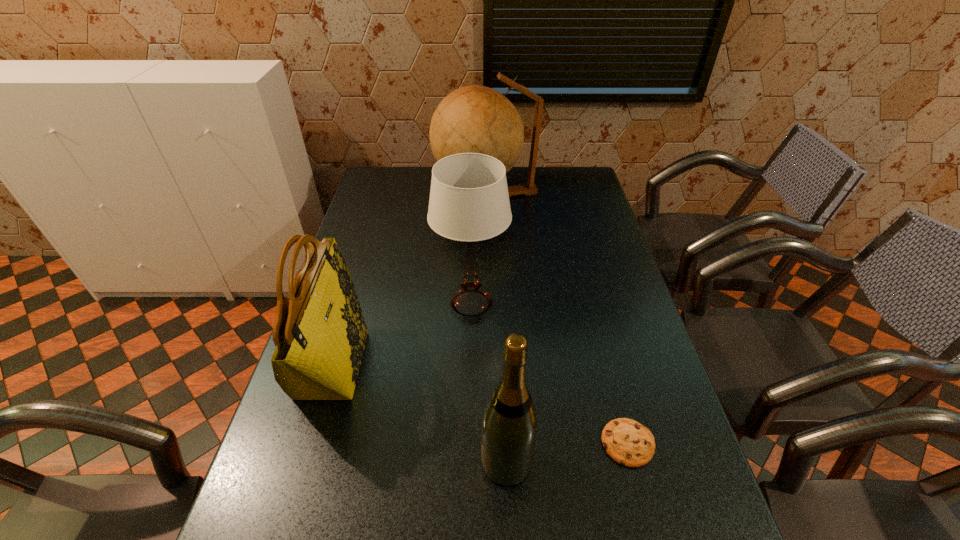
At what (x,y) coordinates should I click in order to perform the action: click on the farthest object. Please return your answer as a coordinate pair (x, y). Looking at the image, I should click on (473, 119).

Image resolution: width=960 pixels, height=540 pixels. Find the location of `table lamp`. table lamp is located at coordinates (469, 202).

What are the coordinates of `wine bottle` in the screenshot? It's located at (509, 427).

Identify the location of the leftmost object. Image resolution: width=960 pixels, height=540 pixels. (320, 334).

Identify the location of cookie. This screenshot has width=960, height=540. pyautogui.click(x=629, y=443).

The image size is (960, 540). What are the coordinates of `the shortest object` in the screenshot? It's located at (629, 443).

The height and width of the screenshot is (540, 960). I want to click on vacant space located 0.170m on the surface of the farthest object, so click(390, 198).

Locate an element on the screen. blank area located on the surface of the farthest object is located at coordinates 418,198.

At what (x,y) coordinates should I click in order to perform the action: click on vacant region located 0.260m on the surface of the farthest object. Please return your answer as a coordinate pair (x, y). Looking at the image, I should click on (367, 198).

The width and height of the screenshot is (960, 540). What are the coordinates of `vacant space located 0.250m on the front-facing side of the table lamp` in the screenshot? It's located at (591, 303).